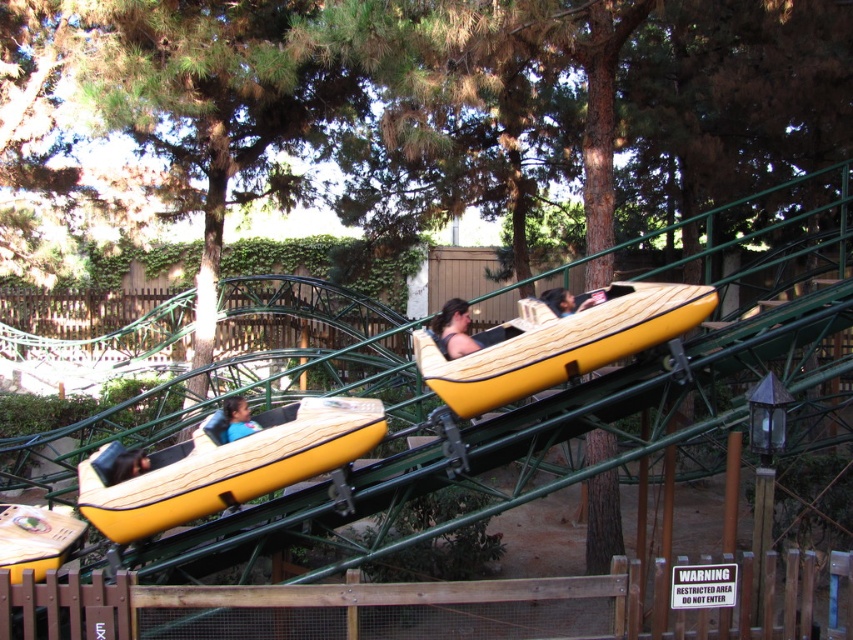
Is wooden raft at center shorter than matte yellow raft at lower left?

No, wooden raft at center is not shorter than matte yellow raft at lower left.

This screenshot has height=640, width=853. Describe the element at coordinates (560, 342) in the screenshot. I see `wooden raft at center` at that location.

In order to click on wooden raft at center in this screenshot , I will do `click(560, 342)`.

Who is more distant from viewer, (x=457, y=355) or (x=561, y=312)?

The point (x=561, y=312) is more distant.

Which is more to the left, matte brown hair at center or smooth tan helmet at center?

matte brown hair at center is more to the left.

Find the location of a particular element. This screenshot has height=640, width=853. matte brown hair at center is located at coordinates (453, 330).

Is matte yellow raft at left taller than wooden raft at center?

No.

Does matte yellow raft at left have a lesser width compared to wooden raft at center?

No, matte yellow raft at left is not thinner than wooden raft at center.

Is point (85, 508) in front of point (599, 356)?

No, it is not.

What are the coordinates of `matte yellow raft at left` in the screenshot? It's located at (225, 465).